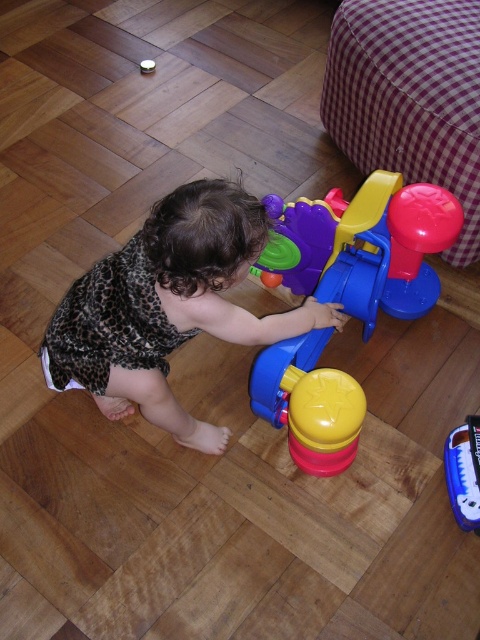
Which is in front, point (267, 212) or point (471, 518)?

Point (471, 518)

Between rubberized plastic toy at center and blue plastic toy at center, which one has more height?

Standing taller between the two is rubberized plastic toy at center.

Which is in front, point (309, 252) or point (476, 467)?

Positioned in front is point (476, 467).

Locate an element on the screen. The height and width of the screenshot is (640, 480). rubberized plastic toy at center is located at coordinates (363, 246).

Is point (122, 330) in front of point (445, 448)?

Yes, it is in front of point (445, 448).

Describe the element at coordinates (168, 307) in the screenshot. This screenshot has width=480, height=640. I see `leopard print dress at center` at that location.

Locate an element on the screen. leopard print dress at center is located at coordinates (168, 307).

Which of these two, leopard print dress at center or rubberized plastic toy at center, stands taller?

With more height is rubberized plastic toy at center.

Who is lower down, leopard print dress at center or rubberized plastic toy at center?

leopard print dress at center is lower down.

I want to click on leopard print dress at center, so click(x=168, y=307).